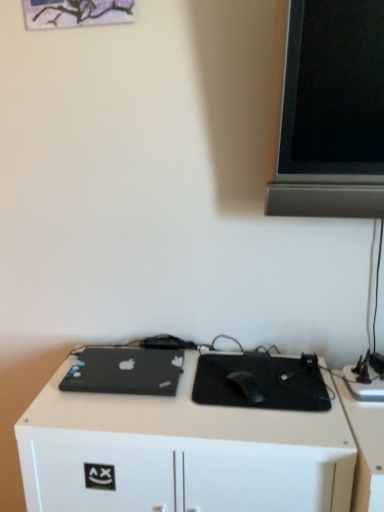
The image size is (384, 512). I want to click on free spot above white matte desk at center (from a real-world perspective), so click(208, 393).